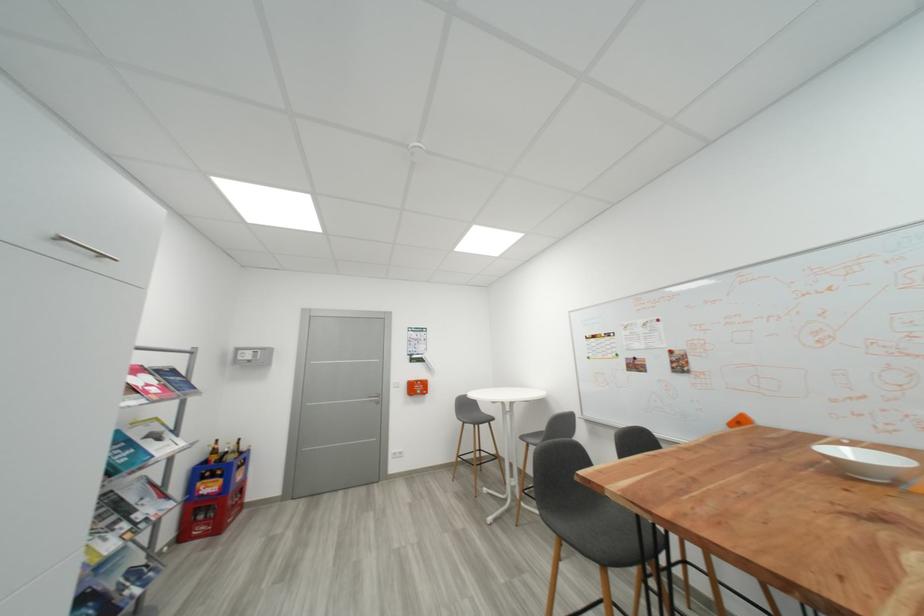
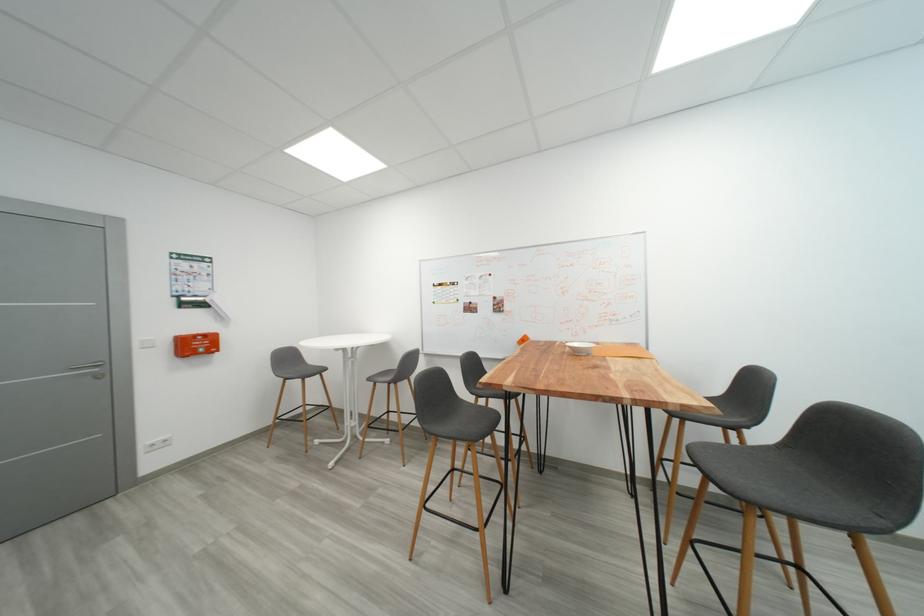
In the second image, find the point that corresponds to the point at 424,390 in the first image.

(203, 347)